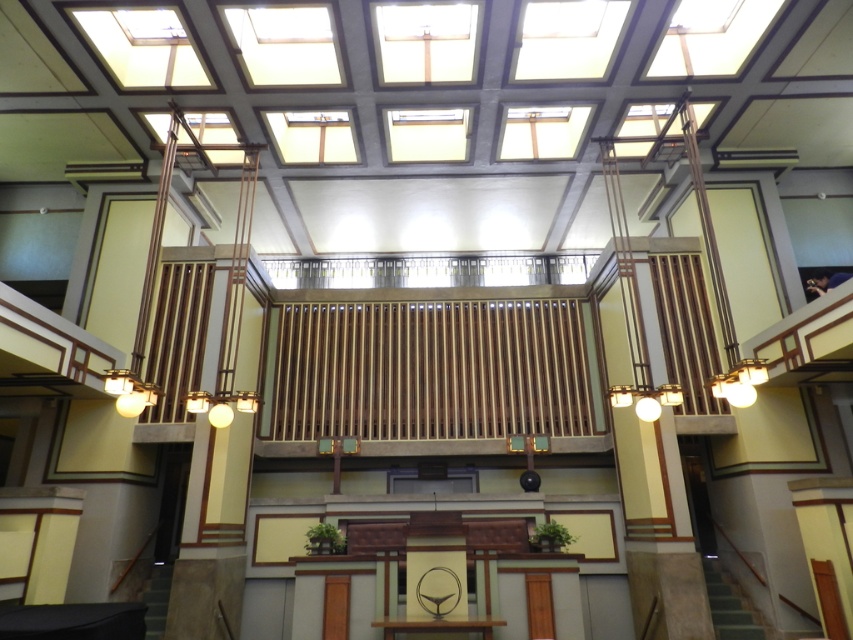
Question: Can you confirm if green carpeted stairs at lower right is wider than dark gray concrete stairs at lower left?

Choices:
 (A) yes
 (B) no

Answer: (B)

Question: Does green carpeted stairs at lower right come behind dark gray concrete stairs at lower left?

Choices:
 (A) yes
 (B) no

Answer: (A)

Question: Which object appears farthest from the camera in this image?

Choices:
 (A) green carpeted stairs at lower right
 (B) dark gray concrete stairs at lower left

Answer: (A)

Question: Is green carpeted stairs at lower right above dark gray concrete stairs at lower left?

Choices:
 (A) yes
 (B) no

Answer: (A)

Question: Among these points, which one is nearest to the camera?

Choices:
 (A) (715, 620)
 (B) (165, 595)

Answer: (A)

Question: Among these objects, which one is farthest from the camera?

Choices:
 (A) dark gray concrete stairs at lower left
 (B) green carpeted stairs at lower right

Answer: (B)